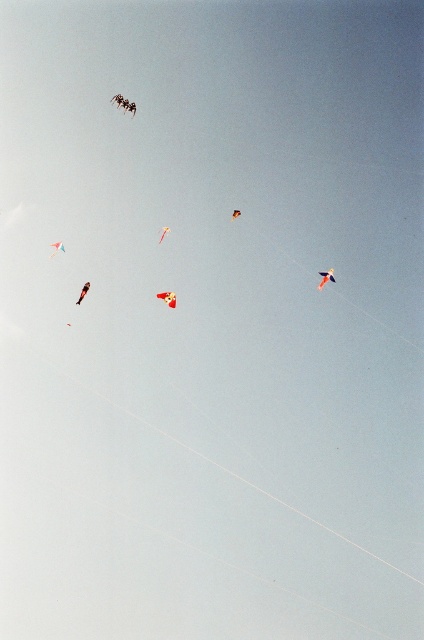
Is matte red kite at upper left taller than orange matte kite at upper center?

Indeed, matte red kite at upper left has a greater height compared to orange matte kite at upper center.

Who is more distant from viewer, (x=52, y=252) or (x=234, y=212)?

Point (x=52, y=252)

Consider the image. Who is more distant from viewer, [60,244] or [236,216]?

Point [60,244]

I want to click on matte red kite at upper left, so click(56, 248).

Is red glossy kite at upper center to the right of translucent red kite at center from the viewer's perspective?

Yes, red glossy kite at upper center is to the right of translucent red kite at center.

What do you see at coordinates (326, 276) in the screenshot? I see `red glossy kite at upper center` at bounding box center [326, 276].

Which is in front, point (321, 275) or point (159, 240)?

Point (321, 275) is in front.

At what (x,y) coordinates should I click in order to perform the action: click on red glossy kite at upper center. Please return your answer as a coordinate pair (x, y). The image size is (424, 640). Looking at the image, I should click on (326, 276).

Which of these two, red glossy kite at upper center or matte red kite at upper left, stands shorter?

matte red kite at upper left

Can you confirm if red glossy kite at upper center is smaller than matte red kite at upper left?

Yes, red glossy kite at upper center is smaller than matte red kite at upper left.

Between point (321, 282) and point (58, 241), which one is positioned behind?

The point (58, 241) is more distant.

The width and height of the screenshot is (424, 640). I want to click on red glossy kite at upper center, so click(326, 276).